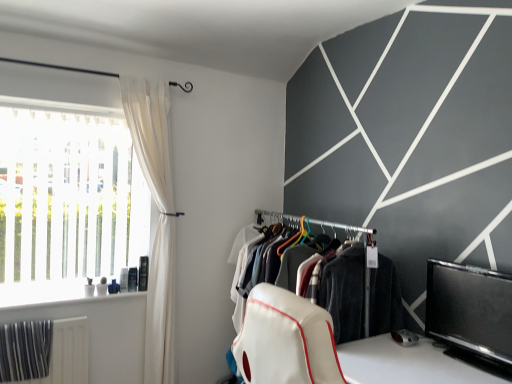
Question: Does metallic silver radiator at lower left come in front of black glossy tv at lower right?

Choices:
 (A) no
 (B) yes

Answer: (A)

Question: Can you confirm if metallic silver radiator at lower left is smaller than black glossy tv at lower right?

Choices:
 (A) yes
 (B) no

Answer: (A)

Question: Can you confirm if metallic silver radiator at lower left is shorter than black glossy tv at lower right?

Choices:
 (A) yes
 (B) no

Answer: (A)

Question: From a real-world perspective, is metallic silver radiator at lower left over black glossy tv at lower right?

Choices:
 (A) yes
 (B) no

Answer: (B)

Question: From a real-world perspective, does metallic silver radiator at lower left sit lower than black glossy tv at lower right?

Choices:
 (A) no
 (B) yes

Answer: (B)

Question: Does metallic silver radiator at lower left have a greater width compared to black glossy tv at lower right?

Choices:
 (A) no
 (B) yes

Answer: (A)

Question: From a real-world perspective, is white translucent blinds at left positioned under black glossy tv at lower right based on gravity?

Choices:
 (A) yes
 (B) no

Answer: (B)

Question: From a real-world perspective, does white translucent blinds at left stand above black glossy tv at lower right?

Choices:
 (A) no
 (B) yes

Answer: (B)

Question: Is the position of white translucent blinds at left less distant than that of black glossy tv at lower right?

Choices:
 (A) yes
 (B) no

Answer: (B)

Question: Does white translucent blinds at left have a larger size compared to black glossy tv at lower right?

Choices:
 (A) no
 (B) yes

Answer: (B)

Question: From the image's perspective, is white translucent blinds at left over black glossy tv at lower right?

Choices:
 (A) no
 (B) yes

Answer: (B)

Question: Is white translucent blinds at left looking in the opposite direction of black glossy tv at lower right?

Choices:
 (A) no
 (B) yes

Answer: (A)

Question: Is white sheer curtain at left bigger than black glossy tv at lower right?

Choices:
 (A) no
 (B) yes

Answer: (B)